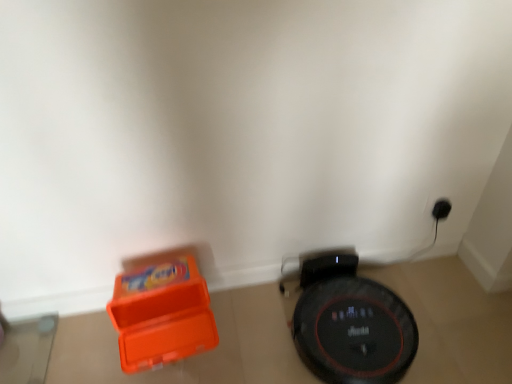
Find the location of a particular element. The image size is (512, 384). vacant area located to the right-hand side of black glossy robot vacuum cleaner at lower right is located at coordinates (448, 314).